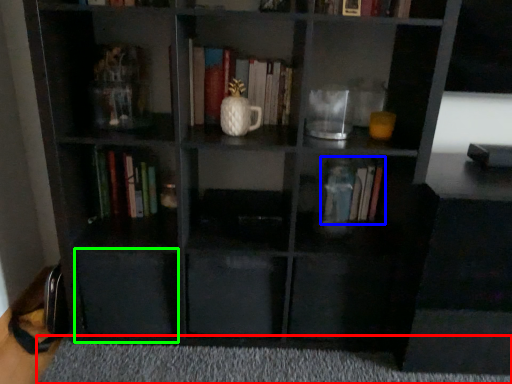
Question: Considering the real-world distances, which object is closest to plain (highlighted by a red box)? book (highlighted by a blue box) or drawer (highlighted by a green box).

Choices:
 (A) book
 (B) drawer

Answer: (B)